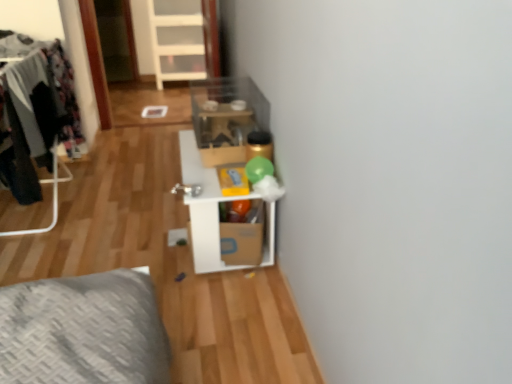
Question: Does dark gray fabric clothes at left have a larger size compared to white plastic ladder at upper center?

Choices:
 (A) no
 (B) yes

Answer: (A)

Question: From the image's perspective, does dark gray fabric clothes at left appear higher than white plastic ladder at upper center?

Choices:
 (A) yes
 (B) no

Answer: (B)

Question: Can you confirm if dark gray fabric clothes at left is taller than white plastic ladder at upper center?

Choices:
 (A) no
 (B) yes

Answer: (A)

Question: Considering the relative sizes of dark gray fabric clothes at left and white plastic ladder at upper center in the image provided, is dark gray fabric clothes at left smaller than white plastic ladder at upper center?

Choices:
 (A) no
 (B) yes

Answer: (B)

Question: Is dark gray fabric clothes at left facing away from white plastic ladder at upper center?

Choices:
 (A) yes
 (B) no

Answer: (B)

Question: Considering the relative positions of dark gray fabric clothes at left and white plastic ladder at upper center in the image provided, is dark gray fabric clothes at left to the left of white plastic ladder at upper center from the viewer's perspective?

Choices:
 (A) yes
 (B) no

Answer: (A)

Question: Does white plastic ladder at upper center turn towards cardboard box at center?

Choices:
 (A) yes
 (B) no

Answer: (A)

Question: Can you confirm if white plastic ladder at upper center is bigger than cardboard box at center?

Choices:
 (A) yes
 (B) no

Answer: (A)

Question: Is white plastic ladder at upper center positioned with its back to cardboard box at center?

Choices:
 (A) yes
 (B) no

Answer: (B)

Question: Is white plastic ladder at upper center touching cardboard box at center?

Choices:
 (A) yes
 (B) no

Answer: (B)

Question: Is white plastic ladder at upper center surrounding cardboard box at center?

Choices:
 (A) no
 (B) yes

Answer: (A)

Question: Is white plastic ladder at upper center shorter than cardboard box at center?

Choices:
 (A) yes
 (B) no

Answer: (B)

Question: Considering the relative sizes of dark gray fabric clothes at left and cardboard box at center in the image provided, is dark gray fabric clothes at left shorter than cardboard box at center?

Choices:
 (A) yes
 (B) no

Answer: (B)